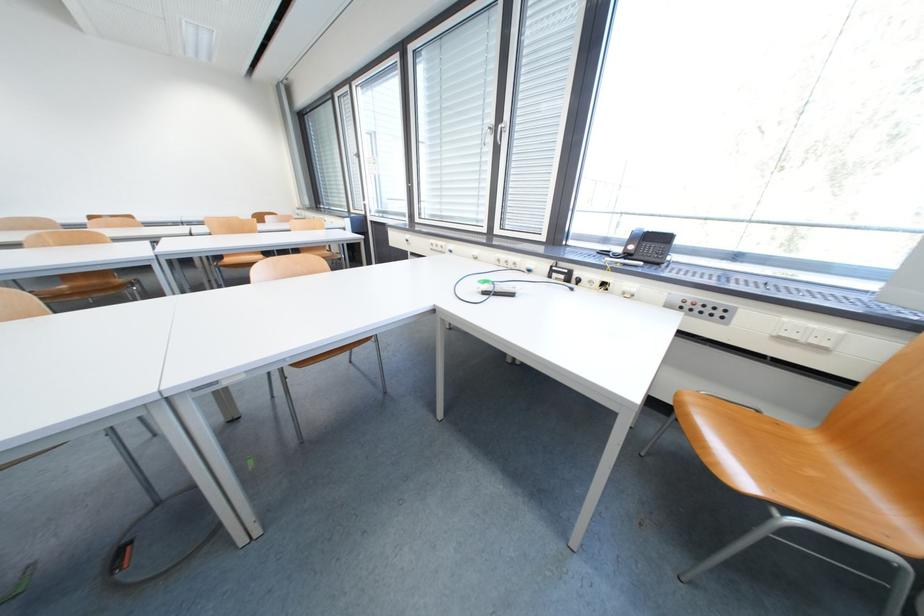
The image size is (924, 616). What are the coordinates of `brown chair sitting surface` in the screenshot? It's located at click(782, 464).